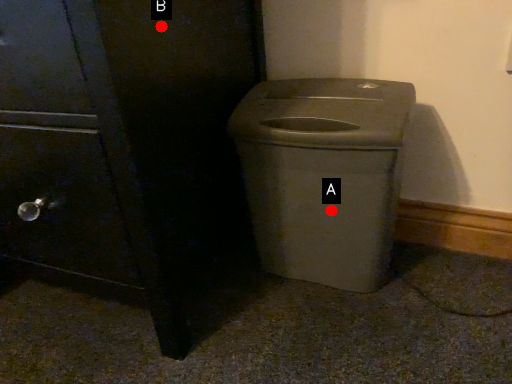
Question: Two points are circled on the image, labeled by A and B beside each circle. Which point is closer to the camera taking this photo?

Choices:
 (A) A is closer
 (B) B is closer

Answer: (B)